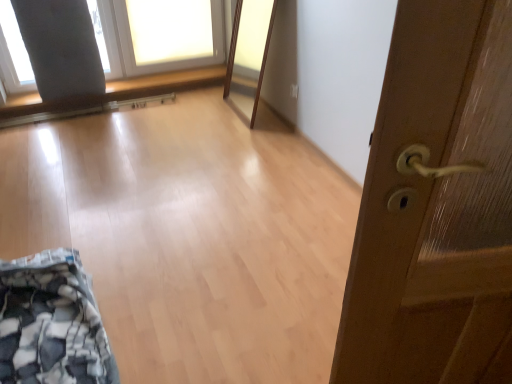
Question: From a real-world perspective, is wooden door handle at right physically located above or below white fabric at upper left?

Choices:
 (A) above
 (B) below

Answer: (A)

Question: Is wooden door handle at right spatially inside white fabric at upper left, or outside of it?

Choices:
 (A) inside
 (B) outside

Answer: (B)

Question: In the image, is wooden door handle at right on the left side or the right side of white fabric at upper left?

Choices:
 (A) left
 (B) right

Answer: (B)

Question: Considering the positions of white fabric at upper left and wooden door handle at right in the image, is white fabric at upper left taller or shorter than wooden door handle at right?

Choices:
 (A) tall
 (B) short

Answer: (B)

Question: In terms of width, does white fabric at upper left look wider or thinner when compared to wooden door handle at right?

Choices:
 (A) thin
 (B) wide

Answer: (B)

Question: From the image's perspective, is white fabric at upper left located above or below wooden door handle at right?

Choices:
 (A) above
 (B) below

Answer: (A)

Question: Considering their positions, is white fabric at upper left located in front of or behind wooden door handle at right?

Choices:
 (A) behind
 (B) front

Answer: (A)